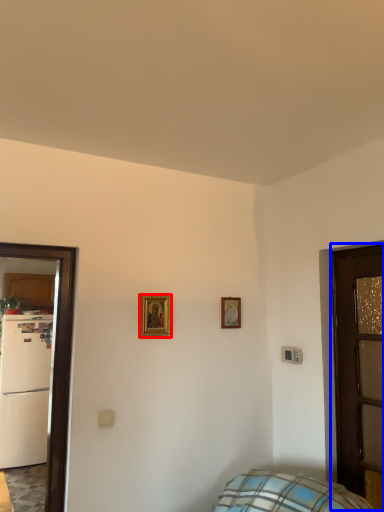
Question: Among these objects, which one is farthest to the camera, picture frame (highlighted by a red box) or door (highlighted by a blue box)?

Choices:
 (A) picture frame
 (B) door

Answer: (A)